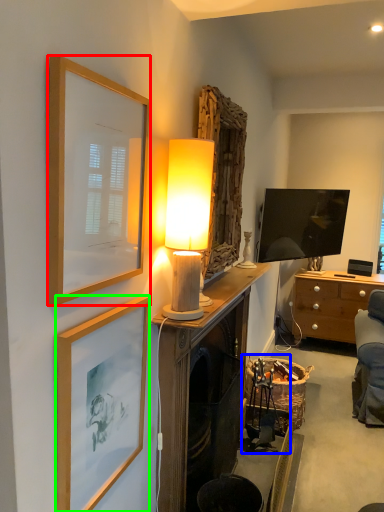
Question: Which is nearer to the picture frame (highlighted by a red box)? swivel chair (highlighted by a blue box) or picture frame (highlighted by a green box).

Choices:
 (A) swivel chair
 (B) picture frame

Answer: (B)